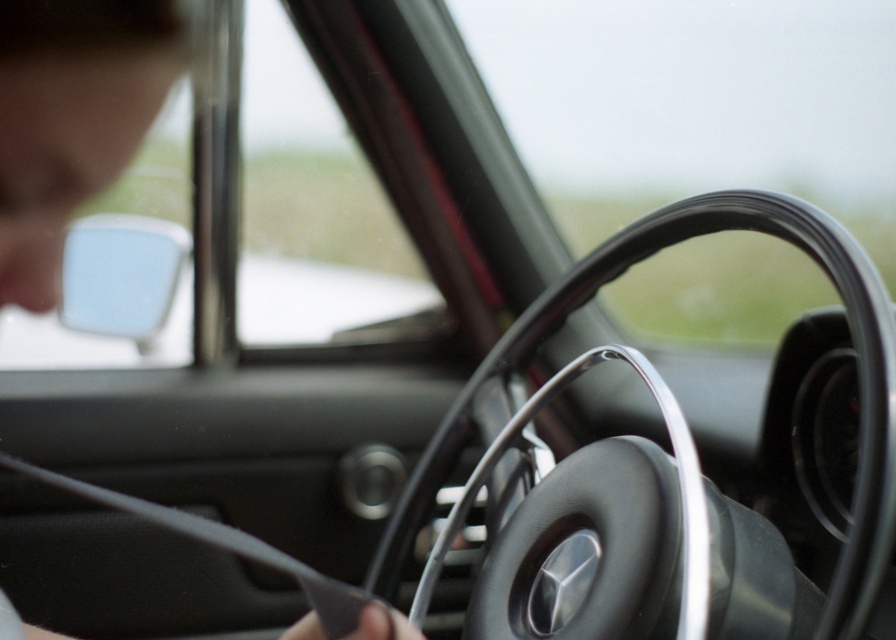
You are a passenger in the car and want to reach the black leather steering wheel at center from the matte black hair at upper left. Can you comfortably reach it without moving your seat?

The distance between matte black hair at upper left and black leather steering wheel at center is 21.02 inches, which is a typical comfortable reach for most adults, so yes, you can comfortably reach the black leather steering wheel at center without moving your seat.

You are sitting in the driver seat of the car and see two points marked in the image. Which point is closer to you, point (61, 83) or point (616, 250)?

Point (61, 83) is in front of point (616, 250), so it is closer to you.

You are a passenger in the car and notice a point of interest at coordinate point (70,120). What object is located at that point?

The matte black hair at upper left is located at point (70,120).